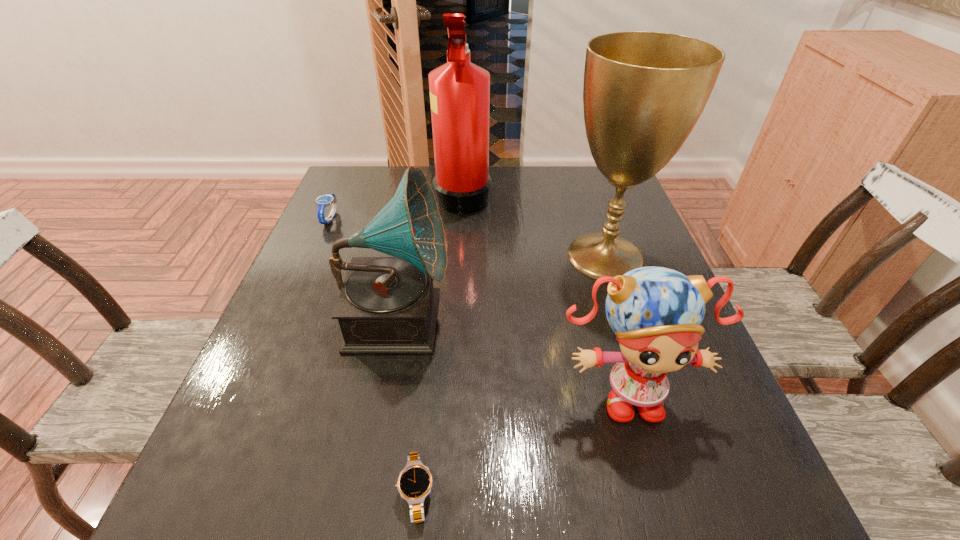
Where is `trophy cup located in the right edge section of the desktop`? This screenshot has width=960, height=540. trophy cup located in the right edge section of the desktop is located at coordinates (643, 93).

At what (x,y) coordinates should I click in order to perform the action: click on doll located in the right edge section of the desktop. Please return your answer as a coordinate pair (x, y). Image resolution: width=960 pixels, height=540 pixels. Looking at the image, I should click on (656, 313).

What are the coordinates of `object at the far left corner` in the screenshot? It's located at (322, 201).

You are a GUI agent. You are given a task and a screenshot of the screen. Output one action in this format:
    pyautogui.click(x=<x>, y=<y>)
    Task: Click on the free region at the far edge of the desktop
    The height and width of the screenshot is (540, 960).
    Given the screenshot: What is the action you would take?
    pyautogui.click(x=505, y=195)

The height and width of the screenshot is (540, 960). In the image, there is a desktop. Find the location of `vacant region at the near edge`. vacant region at the near edge is located at coordinates (373, 508).

Find the location of a particular element. free point at the left edge is located at coordinates (256, 413).

In the image, there is a desktop. Identify the location of vacant space at the right edge. The height and width of the screenshot is (540, 960). (740, 441).

Find the location of a particular element. The image size is (960, 540). free spot between the shortest object and the trophy cup is located at coordinates (511, 374).

Locate an element on the screen. This screenshot has height=540, width=960. empty space between the shorter watch and the trophy cup is located at coordinates [511, 374].

Locate an element on the screen. This screenshot has width=960, height=540. vacant area that lies between the trophy cup and the leftmost object is located at coordinates (468, 238).